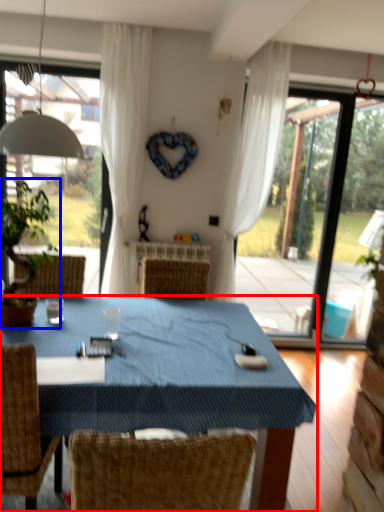
Question: Among these objects, which one is farthest to the camera, table (highlighted by a red box) or houseplant (highlighted by a blue box)?

Choices:
 (A) table
 (B) houseplant

Answer: (B)